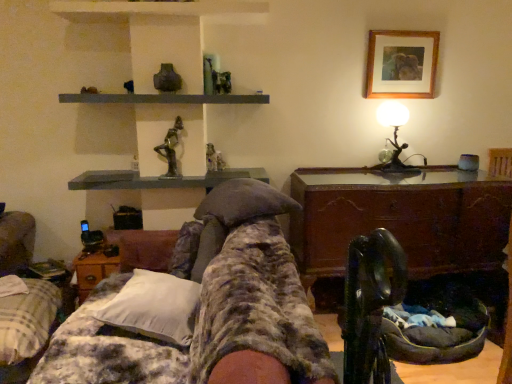
Identify the location of white soft pillow at center. pos(154,307).

I want to click on woodenmaterial/texturetable at lower left, acting as the 1th table starting from the left, so click(93, 270).

How much space does plaid fabric bedspread at lower left, the second furniture positioned from the right, occupy vertically?

The height of plaid fabric bedspread at lower left, the second furniture positioned from the right, is 47.37 centimeters.

You are a GUI agent. You are given a task and a screenshot of the screen. Output one action in this format:
    pyautogui.click(x=<x>, y=<y>)
    Task: Click on the plaid fabric bedspread at lower left, the second furniture positioned from the right
    The width and height of the screenshot is (512, 384).
    Given the screenshot: What is the action you would take?
    pyautogui.click(x=26, y=327)

Identify the location of fluffy fabric blanket at center, marked as the second furniture in a left-to-right arrangement. tap(210, 307).

Describe the element at coordinates (170, 149) in the screenshot. Image resolution: width=512 pixels, height=384 pixels. I see `bronze statue at upper center` at that location.

Measure the distance between bronze statue at upper center and camera.

They are 2.64 meters apart.

At what (x,y) coordinates should I click in order to perform the action: click on white soft pillow at center. Please return your answer as a coordinate pair (x, y). This screenshot has width=512, height=384. Looking at the image, I should click on (154, 307).

Looking at this image, from the image's perspective, relative to bronze statue at upper center, is woodenmaterial/texturetable at lower left, acting as the 1th table starting from the left, above or below?

Clearly, from the image's perspective, woodenmaterial/texturetable at lower left, acting as the 1th table starting from the left, is below bronze statue at upper center.

From the picture: Who is smaller, woodenmaterial/texturetable at lower left, acting as the 1th table starting from the left, or bronze statue at upper center?

With smaller size is bronze statue at upper center.

Where is `person that appears on the right of woodenmaterial/texturetable at lower left, the 2th table positioned from the right`? Image resolution: width=512 pixels, height=384 pixels. person that appears on the right of woodenmaterial/texturetable at lower left, the 2th table positioned from the right is located at coordinates point(170,149).

Between woodenmaterial/texturetable at lower left, the 2th table positioned from the right, and bronze statue at upper center, which one has more height?

With more height is bronze statue at upper center.

From the image's perspective, which object appears higher, white soft pillow at center or bronze statue at upper center?

From the image's view, bronze statue at upper center is above.

Are white soft pillow at center and bronze statue at upper center far apart?

Absolutely, white soft pillow at center is distant from bronze statue at upper center.

Which of these two, white soft pillow at center or bronze statue at upper center, stands shorter?

white soft pillow at center is shorter.

Considering the points (114, 302) and (170, 165), which point is behind, point (114, 302) or point (170, 165)?

The point (170, 165) is farther.

From a real-world perspective, between plaid fabric bedspread at lower left, the second furniture positioned from the right, and woodenmaterial/texturetable at lower left, acting as the 1th table starting from the left, who is vertically lower?

plaid fabric bedspread at lower left, the second furniture positioned from the right, from a real-world perspective.

Is plaid fabric bedspread at lower left, the second furniture positioned from the right, looking in the opposite direction of woodenmaterial/texturetable at lower left, the 2th table positioned from the right?

No.

Which is in front, point (19, 318) or point (79, 260)?

The point (19, 318) is in front.

In the image, is plaid fabric bedspread at lower left, the second furniture positioned from the right, positioned in front of or behind woodenmaterial/texturetable at lower left, the 2th table positioned from the right?

In the image, plaid fabric bedspread at lower left, the second furniture positioned from the right, appears in front of woodenmaterial/texturetable at lower left, the 2th table positioned from the right.

In the scene shown: Can you confirm if bronze statue at upper center is smaller than woodenmaterial/texturetable at lower left, acting as the 1th table starting from the left?

Correct, bronze statue at upper center occupies less space than woodenmaterial/texturetable at lower left, acting as the 1th table starting from the left.

Would you say bronze statue at upper center is inside or outside woodenmaterial/texturetable at lower left, the 2th table positioned from the right?

bronze statue at upper center cannot be found inside woodenmaterial/texturetable at lower left, the 2th table positioned from the right.

Consider the image. From the image's perspective, which object appears higher, bronze statue at upper center or woodenmaterial/texturetable at lower left, the 2th table positioned from the right?

bronze statue at upper center appears higher in the image.

Is bronze statue at upper center not near woodenmaterial/texturetable at lower left, the 2th table positioned from the right?

Actually, bronze statue at upper center and woodenmaterial/texturetable at lower left, the 2th table positioned from the right, are a little close together.

Is wooden picture frame at upper right facing towards woodenmaterial/texturetable at lower left, the 2th table positioned from the right?

No, wooden picture frame at upper right is not facing towards woodenmaterial/texturetable at lower left, the 2th table positioned from the right.

Is wooden picture frame at upper right far away from woodenmaterial/texturetable at lower left, the 2th table positioned from the right?

wooden picture frame at upper right is positioned a significant distance from woodenmaterial/texturetable at lower left, the 2th table positioned from the right.

Is wooden picture frame at upper right to the left of woodenmaterial/texturetable at lower left, acting as the 1th table starting from the left, from the viewer's perspective?

No.

How different are the orientations of bronze statue at upper center and matte gray figurine at center in degrees?

There is a 1.6-degree angle between the facing directions of bronze statue at upper center and matte gray figurine at center.

From a real-world perspective, which object rests below the other?

matte gray figurine at center.

Identify the location of person above the matte gray figurine at center (from the image's perspective). The width and height of the screenshot is (512, 384). (170, 149).

From the picture: Does bronze statue at upper center have a greater height compared to matte gray figurine at center?

Yes.

Considering the positions of objects white soft pillow at center and woodenmaterial/texturetable at lower left, acting as the 1th table starting from the left, in the image provided, who is behind, white soft pillow at center or woodenmaterial/texturetable at lower left, acting as the 1th table starting from the left,?

woodenmaterial/texturetable at lower left, acting as the 1th table starting from the left, is more distant.

Could you tell me if white soft pillow at center is facing woodenmaterial/texturetable at lower left, the 2th table positioned from the right?

No, white soft pillow at center is not turned towards woodenmaterial/texturetable at lower left, the 2th table positioned from the right.

How much distance is there between white soft pillow at center and woodenmaterial/texturetable at lower left, acting as the 1th table starting from the left?

white soft pillow at center and woodenmaterial/texturetable at lower left, acting as the 1th table starting from the left, are 26.82 inches apart.

Would you say white soft pillow at center contains woodenmaterial/texturetable at lower left, acting as the 1th table starting from the left?

No, white soft pillow at center does not contain woodenmaterial/texturetable at lower left, acting as the 1th table starting from the left.

Locate an element on the screen. The width and height of the screenshot is (512, 384). table that is the 2nd object located below the bronze statue at upper center (from the image's perspective) is located at coordinates (93, 270).

The width and height of the screenshot is (512, 384). I want to click on pillow below the bronze statue at upper center (from a real-world perspective), so (x=154, y=307).

Based on their spatial positions, is wooden chest at center, placed as the 1th table when sorted from right to left, or metallic gray shelf at upper center closer to plaid fabric bedspread at lower left, acting as the first furniture starting from the left?

The object closer to plaid fabric bedspread at lower left, acting as the first furniture starting from the left, is metallic gray shelf at upper center.

Based on their spatial positions, is woodenmaterial/texturetable at lower left, the 2th table positioned from the right, or white soft pillow at center closer to wooden picture frame at upper right?

Among the two, white soft pillow at center is located nearer to wooden picture frame at upper right.

Which object lies nearer to the anchor point metallic gray shelf at upper center, woodenmaterial/texturetable at lower left, the 2th table positioned from the right, or bronze statue at upper center?

bronze statue at upper center is positioned closer to the anchor metallic gray shelf at upper center.

Estimate the real-world distances between objects in this image. Which object is further from fluffy fabric blanket at center, arranged as the 1th furniture when viewed from the right, wooden picture frame at upper right or woodenmaterial/texturetable at lower left, acting as the 1th table starting from the left?

wooden picture frame at upper right.

Based on their spatial positions, is plaid fabric bedspread at lower left, acting as the first furniture starting from the left, or woodenmaterial/texturetable at lower left, the 2th table positioned from the right, further from wooden picture frame at upper right?

Among the two, plaid fabric bedspread at lower left, acting as the first furniture starting from the left, is located further to wooden picture frame at upper right.

Estimate the real-world distances between objects in this image. Which object is closer to metallic silver table lamp at upper right, white soft pillow at center or woodenmaterial/texturetable at lower left, acting as the 1th table starting from the left?

white soft pillow at center.

Considering their positions, is white soft pillow at center positioned closer to wooden picture frame at upper right than woodenmaterial/texturetable at lower left, the 2th table positioned from the right?

white soft pillow at center.

When comparing their distances from matte gray figurine at center, does woodenmaterial/texturetable at lower left, the 2th table positioned from the right, or fluffy fabric blanket at center, arranged as the 1th furniture when viewed from the right, seem further?

fluffy fabric blanket at center, arranged as the 1th furniture when viewed from the right, is further to matte gray figurine at center.

Identify the location of furniture between fluffy fabric blanket at center, marked as the second furniture in a left-to-right arrangement, and bronze statue at upper center from front to back. (26, 327).

At what (x,y) coordinates should I click in order to perform the action: click on furniture between plaid fabric bedspread at lower left, the second furniture positioned from the right, and wooden picture frame at upper right, in the horizontal direction. Please return your answer as a coordinate pair (x, y). This screenshot has height=384, width=512. Looking at the image, I should click on (210, 307).

I want to click on shelf between woodenmaterial/texturetable at lower left, acting as the 1th table starting from the left, and wooden picture frame at upper right, in the horizontal direction, so click(164, 98).

Image resolution: width=512 pixels, height=384 pixels. I want to click on pillow between plaid fabric bedspread at lower left, the second furniture positioned from the right, and wooden chest at center, the 2th table when ordered from left to right, so click(x=154, y=307).